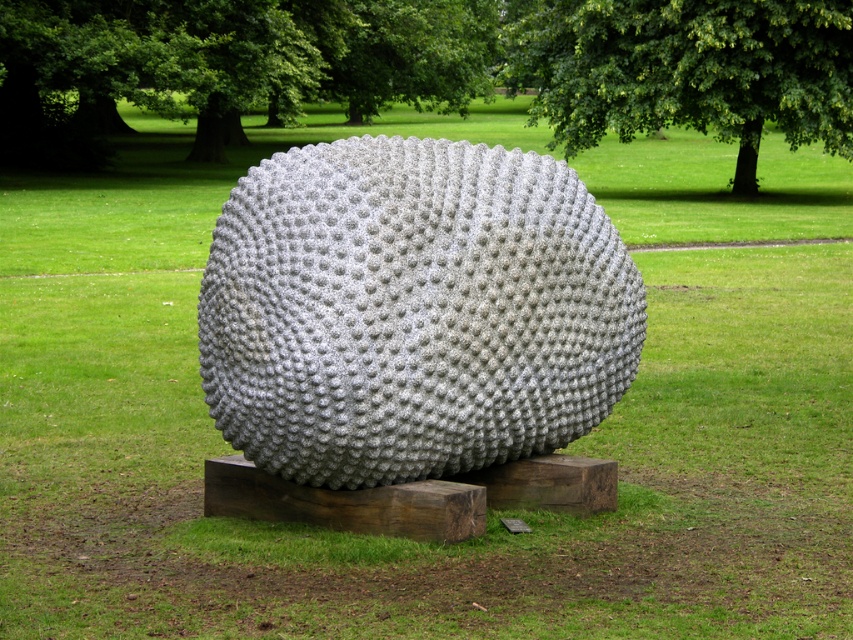
Question: Is sanded concrete sphere at center wider than green leafy tree at upper center?

Choices:
 (A) no
 (B) yes

Answer: (A)

Question: Which point is farther to the camera?

Choices:
 (A) sanded concrete sphere at center
 (B) green leafy tree at upper center

Answer: (B)

Question: Can you confirm if sanded concrete sphere at center is positioned above green leafy tree at upper center?

Choices:
 (A) no
 (B) yes

Answer: (A)

Question: Is the position of sanded concrete sphere at center more distant than that of green leafy tree at upper center?

Choices:
 (A) no
 (B) yes

Answer: (A)